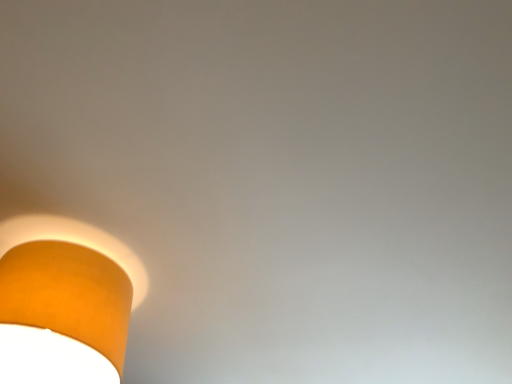
At what (x,y) coordinates should I click in order to perform the action: click on matte yellow lampshade at bottom left. Please return your answer as a coordinate pair (x, y). This screenshot has height=384, width=512. Looking at the image, I should click on (77, 244).

This screenshot has height=384, width=512. What do you see at coordinates (77, 244) in the screenshot?
I see `matte yellow lampshade at bottom left` at bounding box center [77, 244].

In order to face matte yellow lampshade at bottom left, should I rotate leftwards or rightwards?

Rotate left and turn 25.254 degrees.

Identify the location of matte yellow lampshade at bottom left. The width and height of the screenshot is (512, 384). (77, 244).